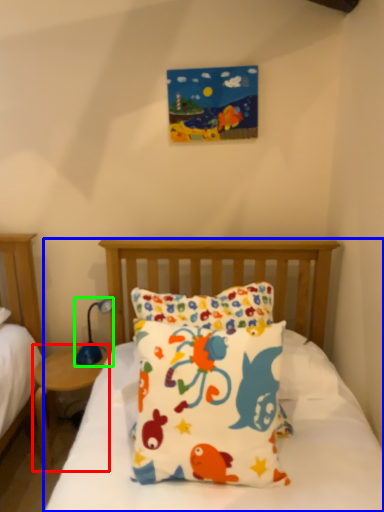
Question: Which object is the closest to the nightstand (highlighted by a red box)? Choose among these: bed (highlighted by a blue box) or table lamp (highlighted by a green box).

Choices:
 (A) bed
 (B) table lamp

Answer: (B)